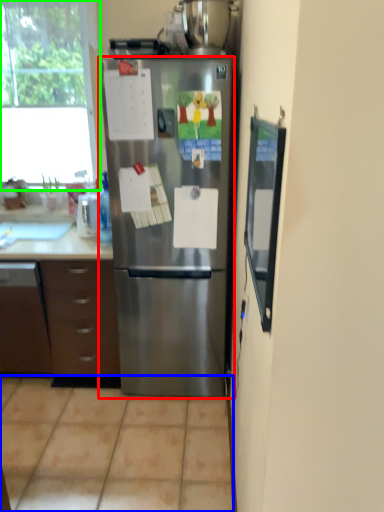
Question: Which is farther away from refrigerator (highlighted by a red box)? tile (highlighted by a blue box) or window (highlighted by a green box)?

Choices:
 (A) tile
 (B) window

Answer: (B)